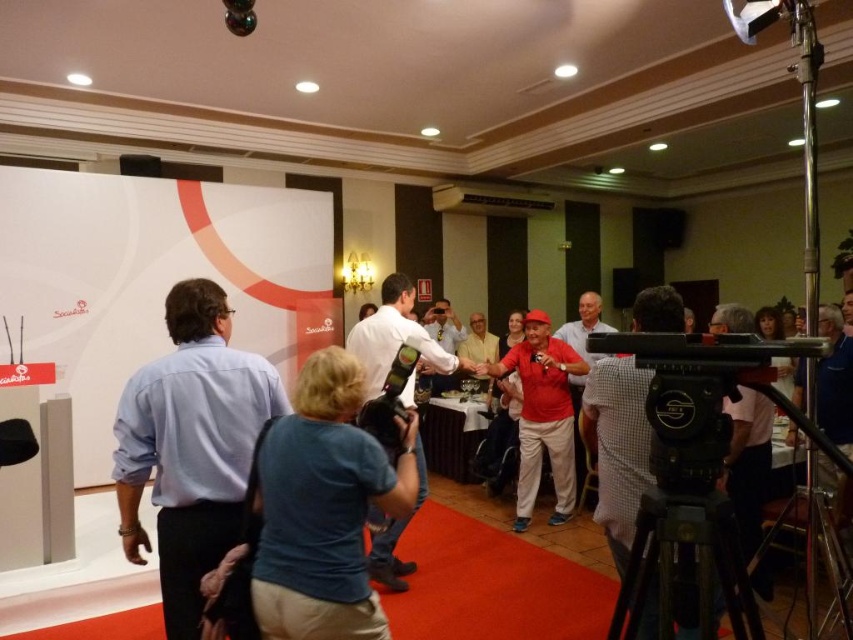
Does blue cotton shirt at center appear on the right side of red matte shirt at center?

In fact, blue cotton shirt at center is to the left of red matte shirt at center.

Which of these two, blue cotton shirt at center or red matte shirt at center, stands taller?

Standing taller between the two is red matte shirt at center.

Which is in front, point (355, 396) or point (560, 499)?

Point (355, 396) is in front.

This screenshot has width=853, height=640. I want to click on blue cotton shirt at center, so click(323, 506).

This screenshot has height=640, width=853. I want to click on black matte tripod at lower right, so click(x=679, y=566).

Is black matte tripod at lower right in front of red matte shirt at center?

Yes, it is in front of red matte shirt at center.

The width and height of the screenshot is (853, 640). I want to click on black matte tripod at lower right, so click(x=679, y=566).

Is light blue shirt at left smaller than matte red shirt at center?

Correct, light blue shirt at left occupies less space than matte red shirt at center.

Does light blue shirt at left have a greater width compared to matte red shirt at center?

Incorrect, light blue shirt at left's width does not surpass matte red shirt at center's.

The width and height of the screenshot is (853, 640). In order to click on light blue shirt at left in this screenshot , I will do `click(190, 445)`.